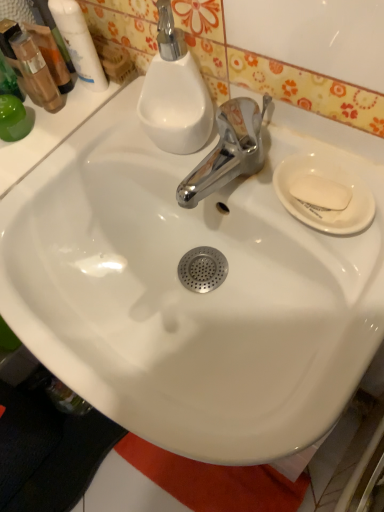
Question: From a real-world perspective, is white glossy mouthwash at upper left, which is counted as the first mouthwash, starting from the right, over white matte soap at right?

Choices:
 (A) no
 (B) yes

Answer: (B)

Question: Is white glossy mouthwash at upper left, acting as the second mouthwash starting from the left, further to camera compared to white matte soap at right?

Choices:
 (A) yes
 (B) no

Answer: (A)

Question: From the image's perspective, does white glossy mouthwash at upper left, which is counted as the first mouthwash, starting from the right, appear higher than white matte soap at right?

Choices:
 (A) no
 (B) yes

Answer: (B)

Question: Is white glossy mouthwash at upper left, which is counted as the first mouthwash, starting from the right, facing towards white matte soap at right?

Choices:
 (A) yes
 (B) no

Answer: (B)

Question: Is white glossy mouthwash at upper left, which is counted as the first mouthwash, starting from the right, closer to the viewer compared to white matte soap at right?

Choices:
 (A) yes
 (B) no

Answer: (B)

Question: Is translucent plastic mouthwash at upper left, which is the second mouthwash in right-to-left order, situated inside white matte soap at right or outside?

Choices:
 (A) inside
 (B) outside

Answer: (B)

Question: Considering the positions of translucent plastic mouthwash at upper left, which is the second mouthwash in right-to-left order, and white matte soap at right in the image, is translucent plastic mouthwash at upper left, which is the second mouthwash in right-to-left order, taller or shorter than white matte soap at right?

Choices:
 (A) tall
 (B) short

Answer: (A)

Question: Is translucent plastic mouthwash at upper left, the 1th mouthwash in the left-to-right sequence, to the left or to the right of white matte soap at right in the image?

Choices:
 (A) right
 (B) left

Answer: (B)

Question: From a real-world perspective, is translucent plastic mouthwash at upper left, which is the second mouthwash in right-to-left order, positioned above or below white matte soap at right?

Choices:
 (A) above
 (B) below

Answer: (A)

Question: Is white matte soap at right in front of or behind white glossy mouthwash at upper left, which is counted as the first mouthwash, starting from the right, in the image?

Choices:
 (A) front
 (B) behind

Answer: (A)

Question: From their relative heights in the image, would you say white matte soap at right is taller or shorter than white glossy mouthwash at upper left, which is counted as the first mouthwash, starting from the right?

Choices:
 (A) tall
 (B) short

Answer: (B)

Question: Based on their sizes in the image, would you say white matte soap at right is bigger or smaller than white glossy mouthwash at upper left, acting as the second mouthwash starting from the left?

Choices:
 (A) big
 (B) small

Answer: (B)

Question: From a real-world perspective, is white matte soap at right physically located above or below white glossy mouthwash at upper left, acting as the second mouthwash starting from the left?

Choices:
 (A) above
 (B) below

Answer: (B)

Question: Is translucent plastic mouthwash at upper left, which is the second mouthwash in right-to-left order, taller or shorter than white ceramic plate at right?

Choices:
 (A) tall
 (B) short

Answer: (A)

Question: Does point (38, 65) appear closer or farther from the camera than point (319, 199)?

Choices:
 (A) farther
 (B) closer

Answer: (A)